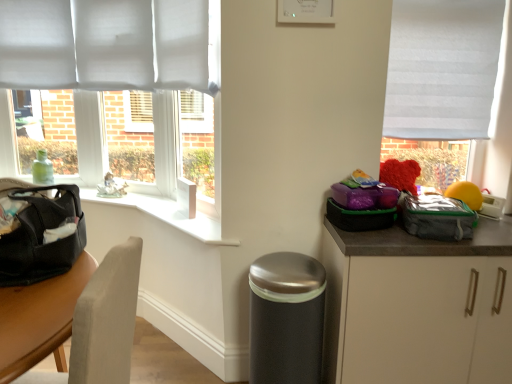
Question: In terms of height, does yellow rubber ball at right look taller or shorter compared to satin silver trash can at lower center?

Choices:
 (A) short
 (B) tall

Answer: (A)

Question: Looking at their shapes, would you say yellow rubber ball at right is wider or thinner than satin silver trash can at lower center?

Choices:
 (A) wide
 (B) thin

Answer: (B)

Question: Estimate the real-world distances between objects in this image. Which object is closer to the white matte cabinet at lower right?

Choices:
 (A) yellow rubber ball at right
 (B) satin silver trash can at lower center
 (C) gray fabric lunch bag at right
 (D) matte black bag at left
 (E) white fabric window at right

Answer: (C)

Question: Which object is the closest to the gray fabric lunch bag at right?

Choices:
 (A) yellow rubber ball at right
 (B) white matte cabinet at lower right
 (C) satin silver trash can at lower center
 (D) matte black bag at left
 (E) white fabric window at right

Answer: (B)